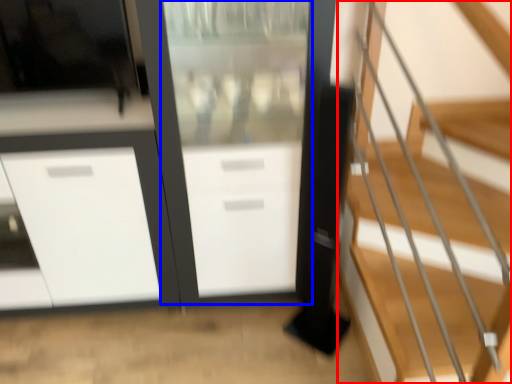
Question: Which point is closer to the camera, stairs (highlighted by a red box) or screen door (highlighted by a blue box)?

Choices:
 (A) stairs
 (B) screen door

Answer: (A)